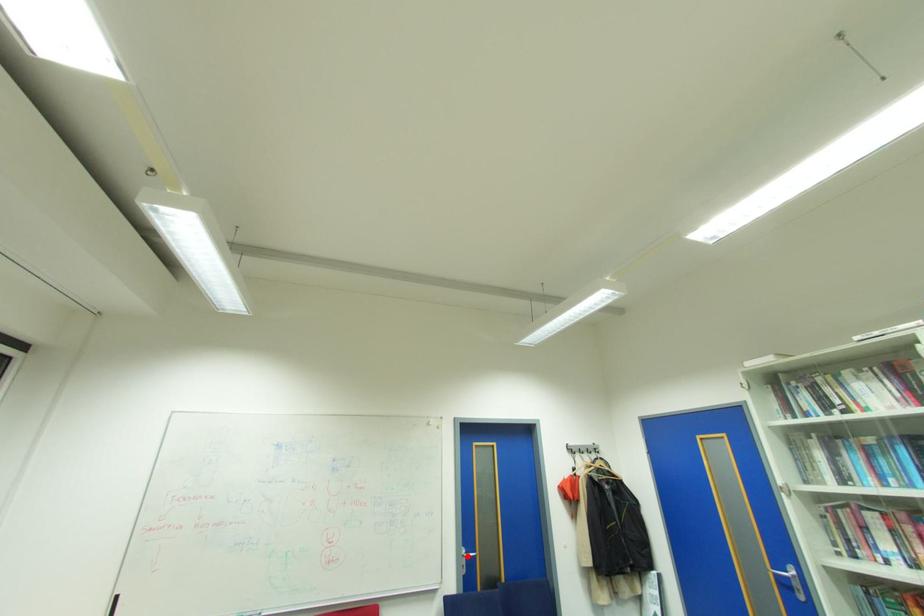
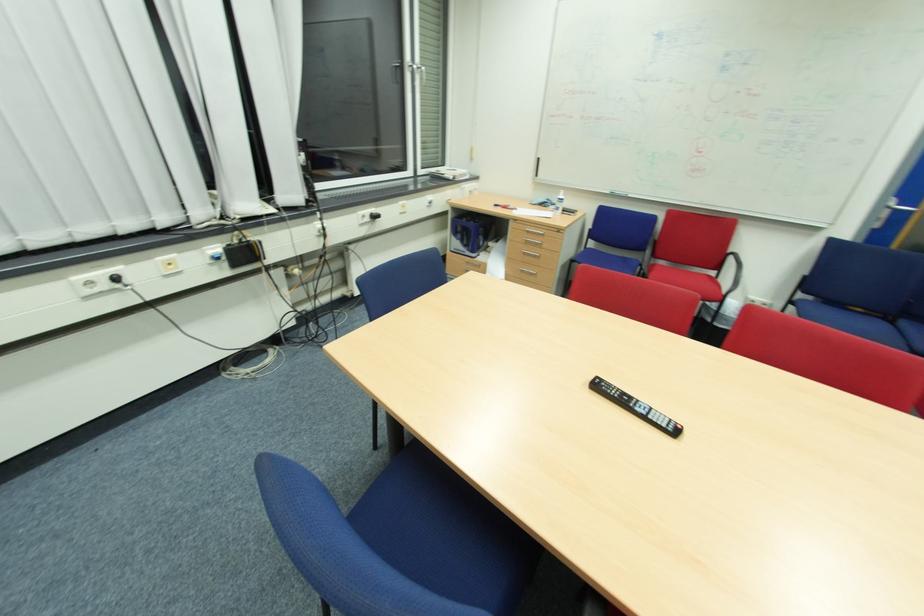
Find the pixel in the second image that matches the highlighted location in the first image.

(894, 206)